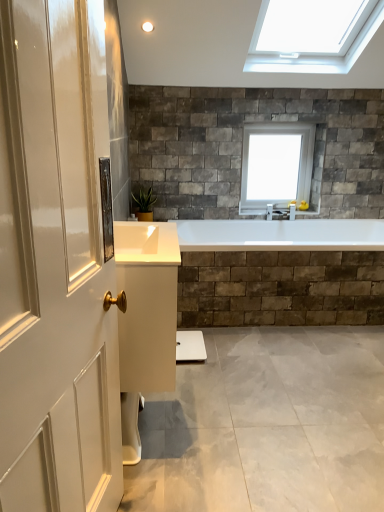
Question: Visually, is transparent glass window at upper center positioned to the left or to the right of green glossy plant at lower left?

Choices:
 (A) left
 (B) right

Answer: (B)

Question: Is transparent glass window at upper center spatially inside green glossy plant at lower left, or outside of it?

Choices:
 (A) outside
 (B) inside

Answer: (A)

Question: Considering their positions, is transparent glass window at upper center located in front of or behind green glossy plant at lower left?

Choices:
 (A) front
 (B) behind

Answer: (B)

Question: Looking at their shapes, would you say green glossy plant at lower left is wider or thinner than transparent glass window at upper center?

Choices:
 (A) wide
 (B) thin

Answer: (A)

Question: Is green glossy plant at lower left spatially inside transparent glass window at upper center, or outside of it?

Choices:
 (A) outside
 (B) inside

Answer: (A)

Question: From a real-world perspective, is green glossy plant at lower left positioned above or below transparent glass window at upper center?

Choices:
 (A) below
 (B) above

Answer: (A)

Question: Is green glossy plant at lower left to the left or to the right of transparent glass window at upper center in the image?

Choices:
 (A) left
 (B) right

Answer: (A)